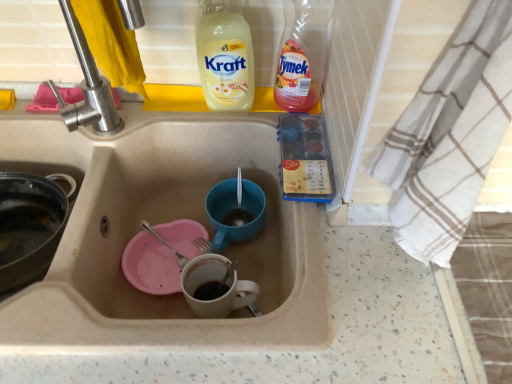
Question: Would you say satin nickel faucet at upper left is to the left or to the right of translucent plastic bottle at upper right in the picture?

Choices:
 (A) right
 (B) left

Answer: (B)

Question: Considering the positions of satin nickel faucet at upper left and translucent plastic bottle at upper right in the image, is satin nickel faucet at upper left wider or thinner than translucent plastic bottle at upper right?

Choices:
 (A) thin
 (B) wide

Answer: (A)

Question: Which is farther from the blue matte cup at center?

Choices:
 (A) white cotton towel at right
 (B) translucent plastic bottle at upper right
 (C) satin nickel faucet at upper left
 (D) yellow liquid soap at upper center
 (E) beige ceramic sink at center

Answer: (A)

Question: Considering the real-world distances, which object is closest to the satin nickel faucet at upper left?

Choices:
 (A) blue matte cup at center
 (B) beige ceramic sink at center
 (C) translucent plastic bottle at upper right
 (D) yellow liquid soap at upper center
 (E) white cotton towel at right

Answer: (B)